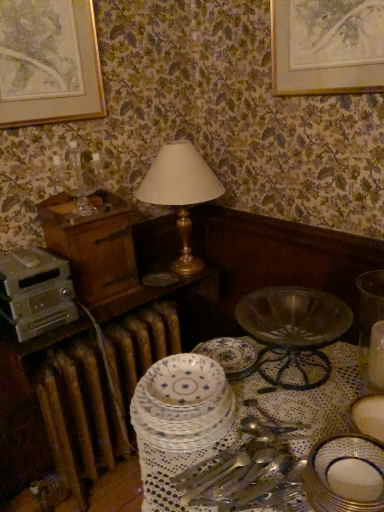
You are a GUI agent. You are given a task and a screenshot of the screen. Output one action in this format:
    pyautogui.click(x=<x>, y=<y>)
    Task: Click on the vacant space behind translucent glass bowl at lower right
    The height and width of the screenshot is (512, 384).
    Given the screenshot: What is the action you would take?
    pyautogui.click(x=343, y=356)